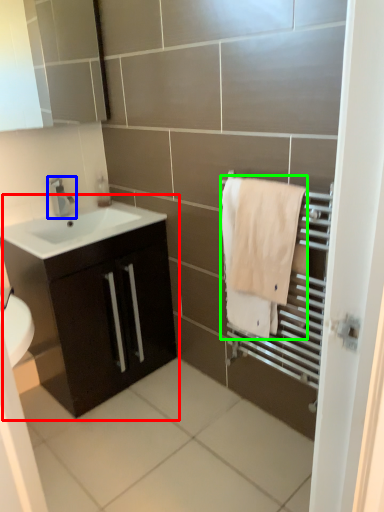
Question: Which is farther away from bathroom cabinet (highlighted by a red box)? tap (highlighted by a blue box) or bath towel (highlighted by a green box)?

Choices:
 (A) tap
 (B) bath towel

Answer: (B)